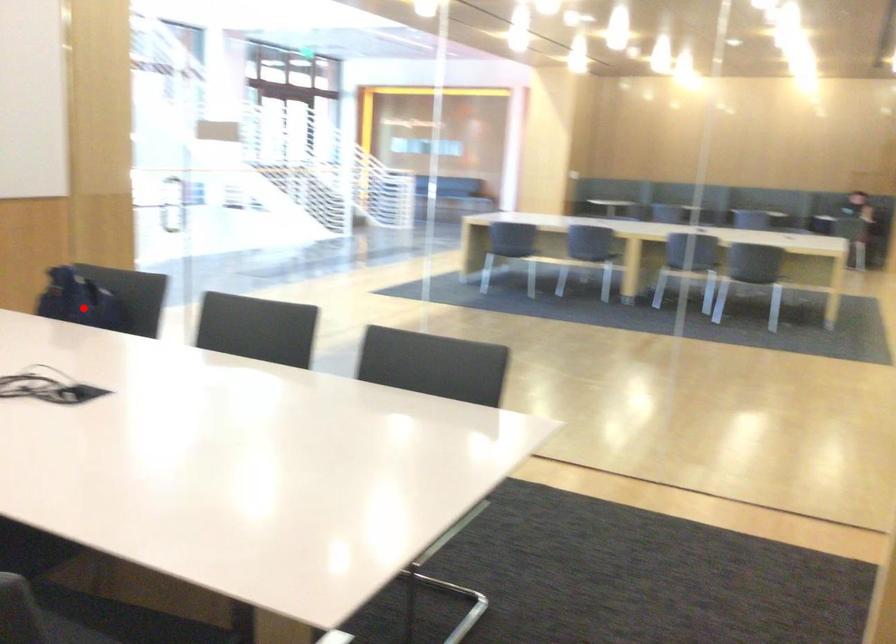
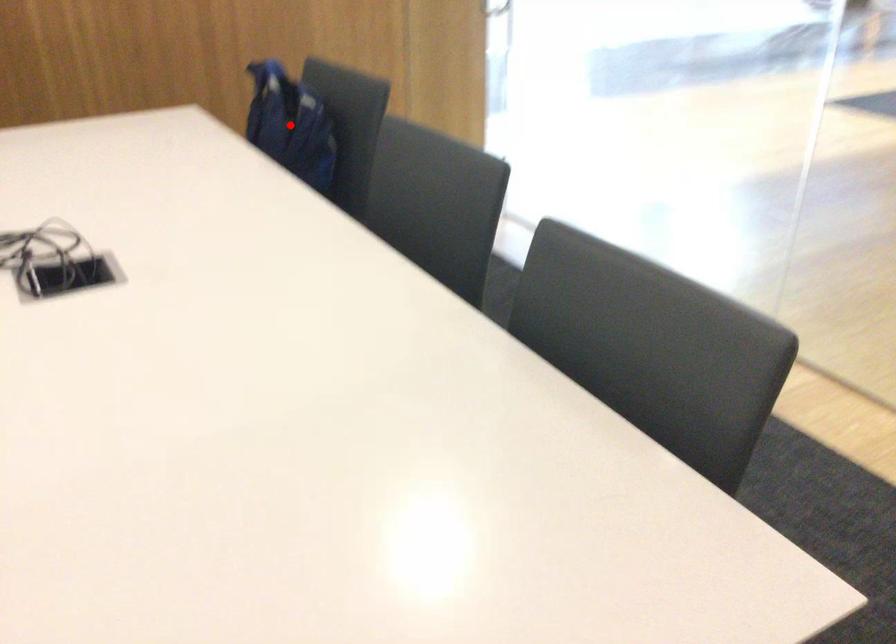
I am providing you with two images of the same scene from different viewpoints. A red point is marked on the first image and another point is marked on the second image. Do the highlighted points in image1 and image2 indicate the same real-world spot?

Yes